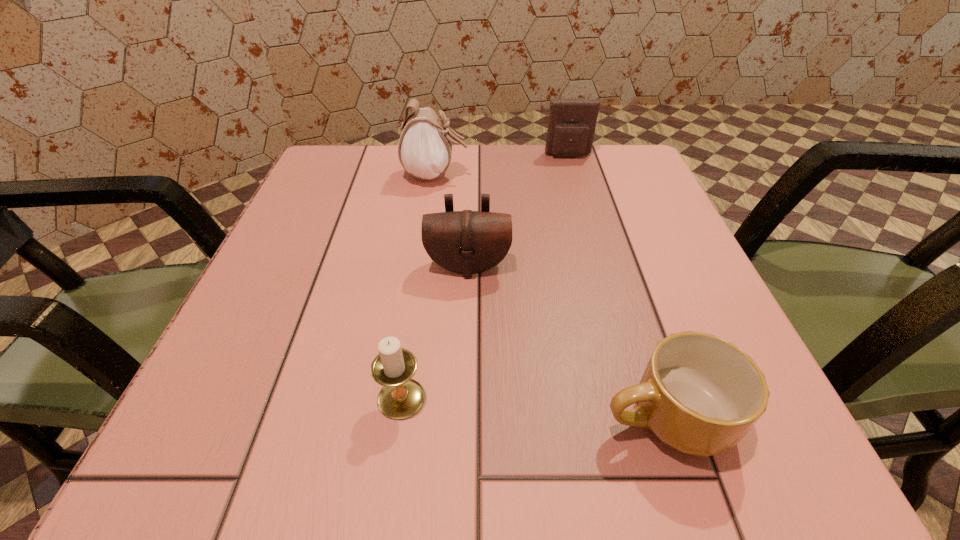
Identify the location of free spot located 0.250m on the right of the candle holder. Image resolution: width=960 pixels, height=540 pixels. (619, 398).

Locate an element on the screen. The image size is (960, 540). vacant area situated 0.080m on the side with the handle of the shortest object is located at coordinates (535, 417).

You are a GUI agent. You are given a task and a screenshot of the screen. Output one action in this format:
    pyautogui.click(x=<x>, y=<y>)
    Task: Click on the free space located on the side with the handle of the shortest object
    
    Given the screenshot: What is the action you would take?
    pyautogui.click(x=310, y=417)

This screenshot has height=540, width=960. Identify the location of vacant space positioned 0.190m on the side with the handle of the shortest object. (446, 417).

The image size is (960, 540). What are the coordinates of `candle holder situated at the near edge` in the screenshot? It's located at (400, 397).

Where is `mug located at the near edge`? Image resolution: width=960 pixels, height=540 pixels. mug located at the near edge is located at coordinates (699, 394).

Identify the location of pouch that is at the right edge. 572,121.

Locate an element on the screen. The width and height of the screenshot is (960, 540). mug present at the right edge is located at coordinates (699, 394).

This screenshot has width=960, height=540. I want to click on object that is at the far right corner, so click(x=572, y=121).

At what (x,y) coordinates should I click in order to perform the action: click on object present at the near right corner. Please return your answer as a coordinate pair (x, y). This screenshot has width=960, height=540. Looking at the image, I should click on (699, 394).